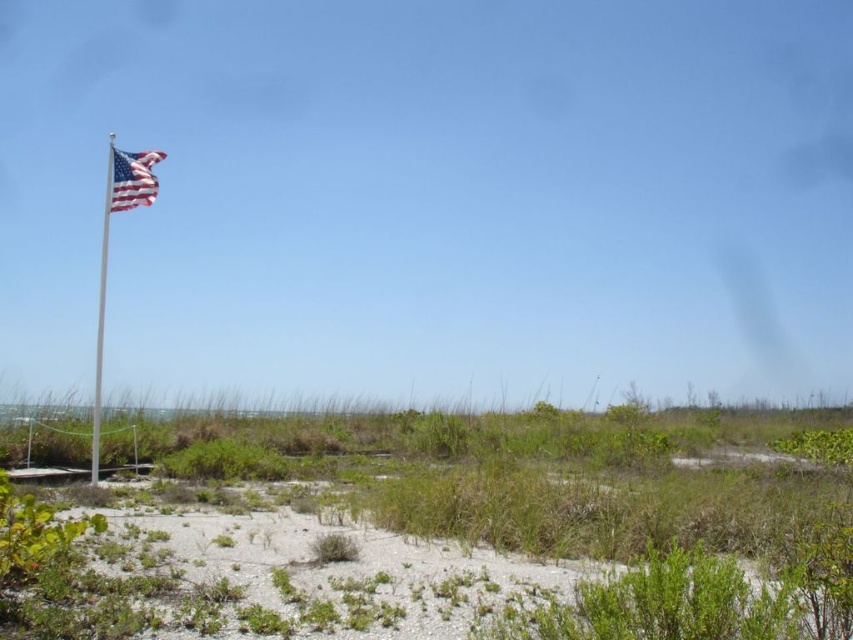
Question: Does green grassy sand at center have a lesser width compared to white metallic flag pole at left?

Choices:
 (A) no
 (B) yes

Answer: (A)

Question: Does green grassy sand at center have a lesser width compared to white metallic flag pole at left?

Choices:
 (A) no
 (B) yes

Answer: (A)

Question: Which point appears closest to the camera in this image?

Choices:
 (A) (144, 195)
 (B) (91, 410)

Answer: (A)

Question: Which point is closer to the camera?

Choices:
 (A) (747, 470)
 (B) (132, 195)
 (C) (103, 305)

Answer: (B)

Question: Which point is closer to the camera taking this photo?

Choices:
 (A) (96, 433)
 (B) (376, 467)
 (C) (125, 205)

Answer: (A)

Question: Can you confirm if green grassy sand at center is wider than matte fabric flag at left?

Choices:
 (A) yes
 (B) no

Answer: (A)